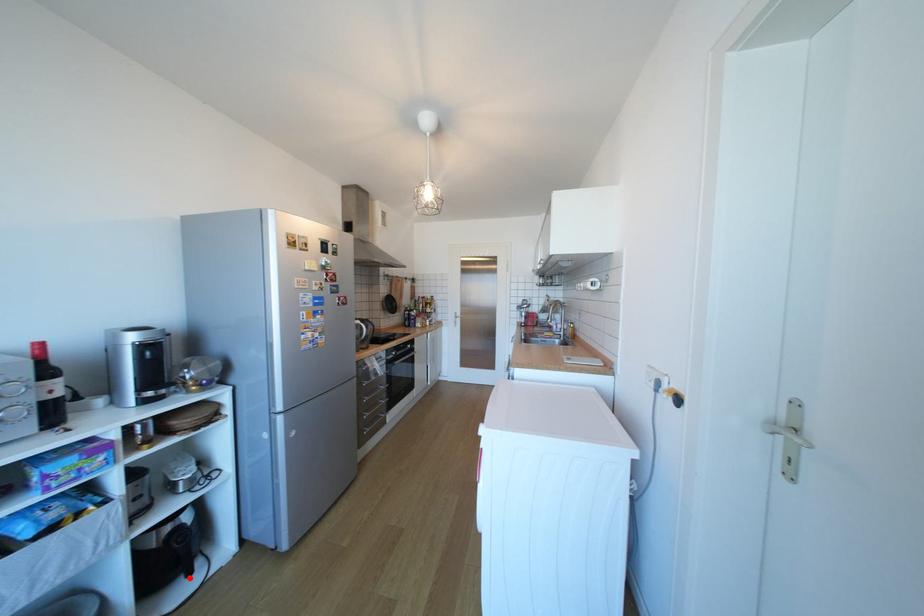
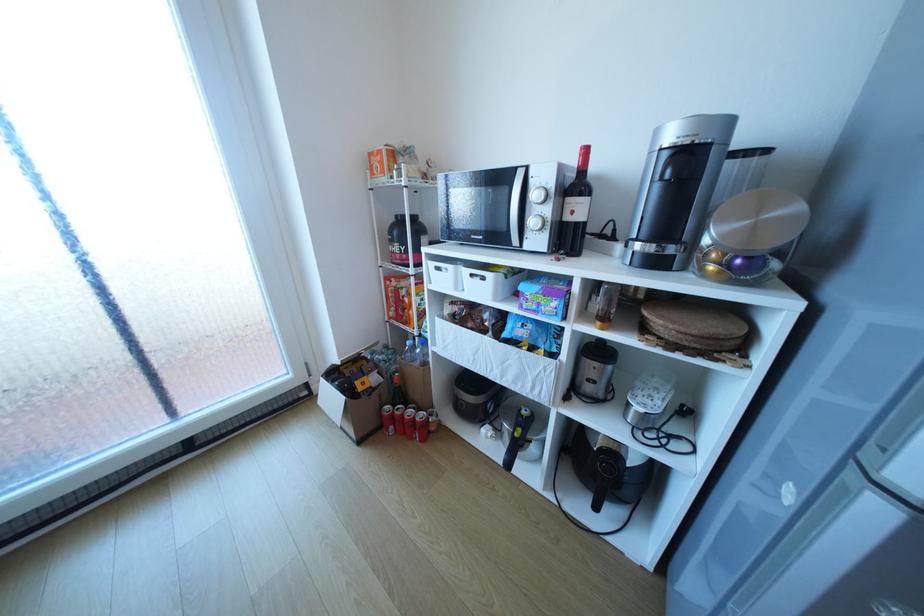
Locate, in the second image, the point that corresponds to the highlighted location in the first image.

(599, 499)